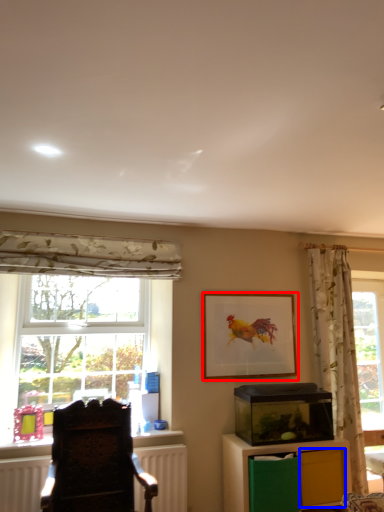
Question: Among these objects, which one is nearest to the camera, picture frame (highlighted by a red box) or drawer (highlighted by a blue box)?

Choices:
 (A) picture frame
 (B) drawer

Answer: (B)